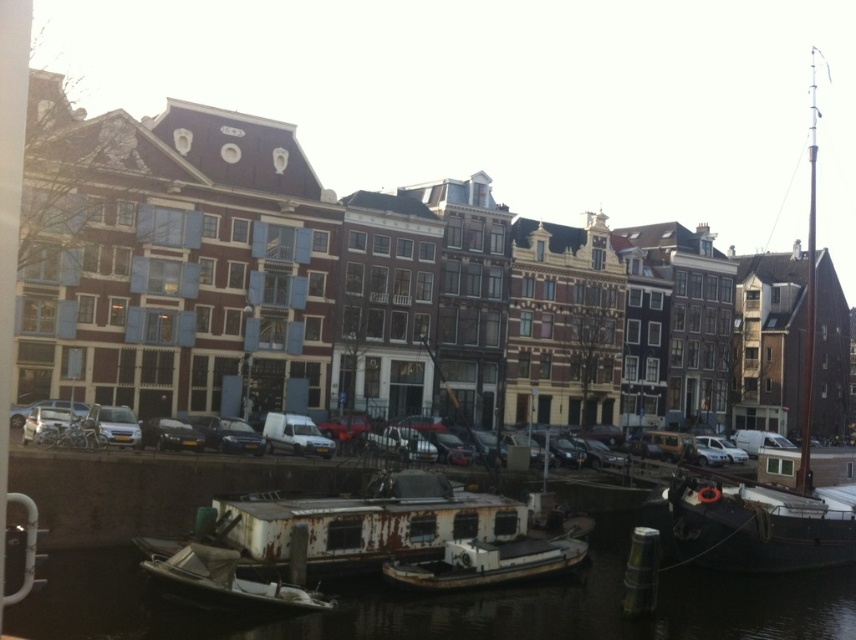
Can you confirm if rusty metal water at lower center is bigger than rusty metal boat at lower right?

Yes.

Which of these two, rusty metal water at lower center or rusty metal boat at lower right, stands shorter?

With less height is rusty metal water at lower center.

Identify the location of rusty metal water at lower center. This screenshot has width=856, height=640. (461, 604).

Where is `rusty metal water at lower center`? This screenshot has width=856, height=640. rusty metal water at lower center is located at coordinates (461, 604).

Can you confirm if rusty metal boat at lower right is bigger than rusty metal boat at center?

Correct, rusty metal boat at lower right is larger in size than rusty metal boat at center.

Is rusty metal boat at lower right further to the viewer compared to rusty metal boat at center?

Yes, rusty metal boat at lower right is behind rusty metal boat at center.

This screenshot has width=856, height=640. Describe the element at coordinates (759, 525) in the screenshot. I see `rusty metal boat at lower right` at that location.

Find the location of `rusty metal boat at lower right`. rusty metal boat at lower right is located at coordinates (759, 525).

In the scene shown: Who is positioned more to the left, rusty metal boat at right or rusty metal boat at center?

rusty metal boat at center

Does rusty metal boat at right lie in front of rusty metal boat at center?

No.

Find the location of a particular element. The height and width of the screenshot is (640, 856). rusty metal boat at right is located at coordinates (773, 476).